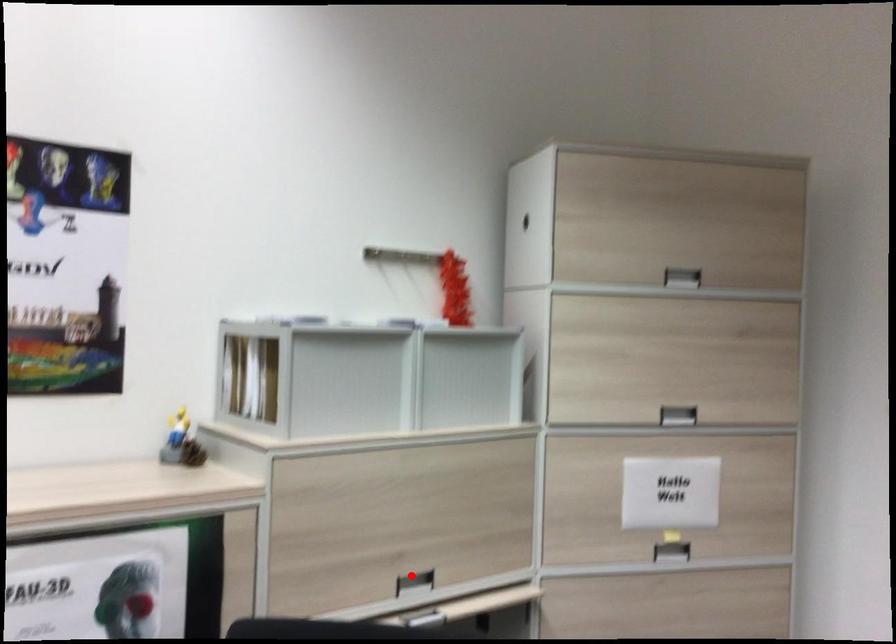
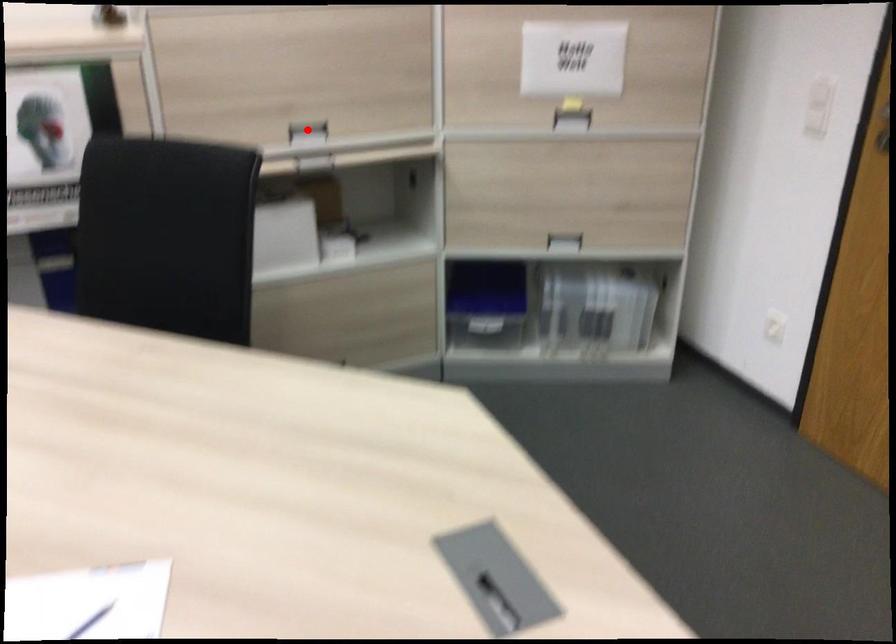
I am providing you with two images of the same scene from different viewpoints. A red point is marked on the first image and another point is marked on the second image. Do the highlighted points in image1 and image2 indicate the same real-world spot?

Yes